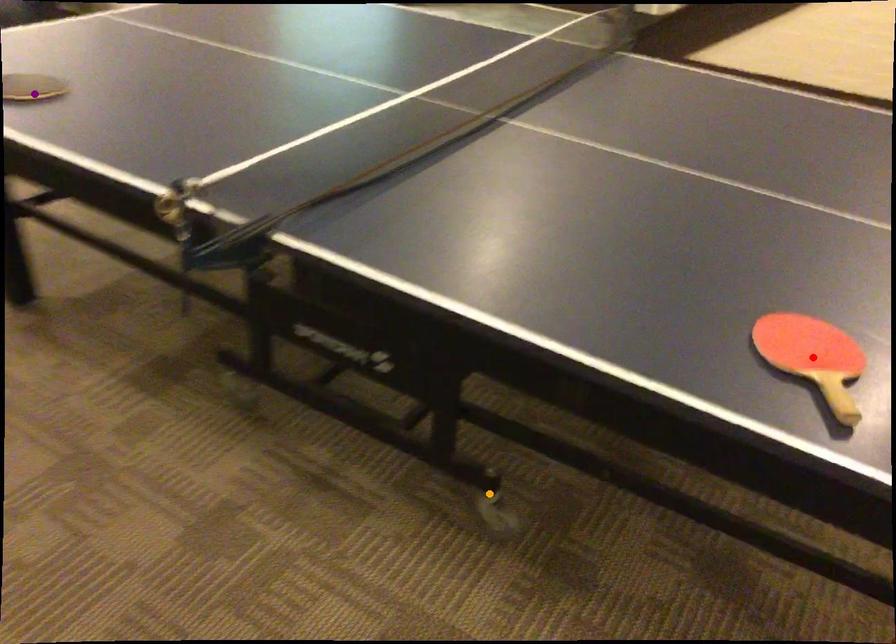
Order these from nearest to farthest:
red point | purple point | orange point

purple point
orange point
red point